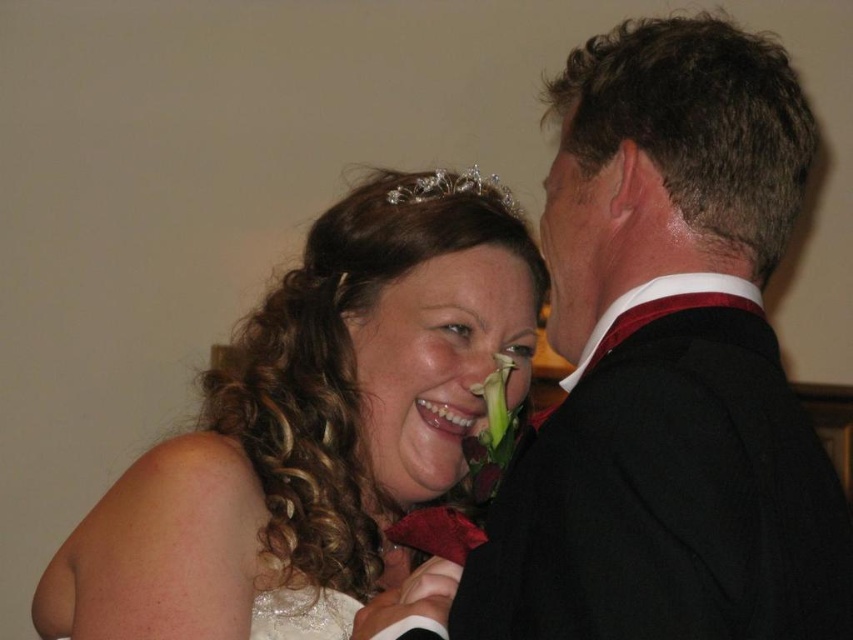
Question: Which object is farther from the camera taking this photo?

Choices:
 (A) clear crystal tiara at upper center
 (B) white lace dress at lower left
 (C) black satin suit at upper right

Answer: (A)

Question: Which point is closer to the camera taking this photo?

Choices:
 (A) (743, 113)
 (B) (274, 612)

Answer: (A)

Question: Observing the image, what is the correct spatial positioning of black satin suit at upper right in reference to clear crystal tiara at upper center?

Choices:
 (A) left
 (B) right

Answer: (B)

Question: Is white satin dress at center thinner than clear crystal tiara at upper center?

Choices:
 (A) no
 (B) yes

Answer: (A)

Question: Is white satin dress at center to the left of clear crystal tiara at upper center from the viewer's perspective?

Choices:
 (A) yes
 (B) no

Answer: (A)

Question: Which of these objects is positioned farthest from the white lace dress at lower left?

Choices:
 (A) black satin suit at upper right
 (B) white satin dress at center

Answer: (A)